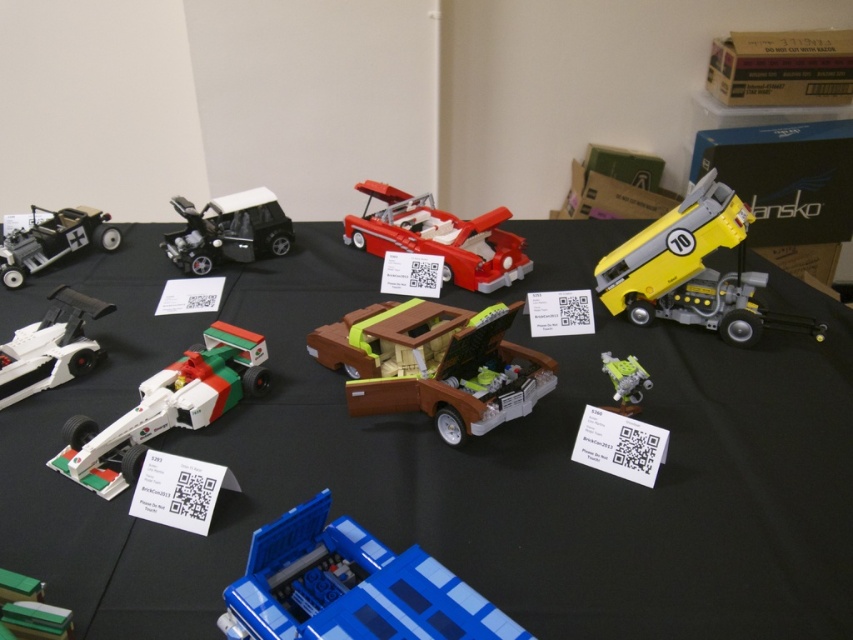
Does point (666, 289) lie in front of point (13, 388)?

That is False.

Between yellow matte truck at right and white matte racing car at left, which one is positioned higher?

yellow matte truck at right is above.

Is point (691, 269) more distant than point (41, 376)?

Yes, it is behind point (41, 376).

Where is `yellow matte truck at right`? Image resolution: width=853 pixels, height=640 pixels. yellow matte truck at right is located at coordinates (692, 269).

Does point (433, 403) come behind point (84, 340)?

No, (433, 403) is in front of (84, 340).

Who is higher up, brown matte car at center or white matte racing car at left?

white matte racing car at left

Is point (393, 408) behind point (91, 353)?

That is False.

The height and width of the screenshot is (640, 853). What are the coordinates of `brown matte car at center` in the screenshot? It's located at (433, 365).

Is matte black car at left behind green plastic robot at lower right?

That is True.

Can you confirm if matte black car at left is wider than green plastic robot at lower right?

Yes.

Is point (74, 237) positioned after point (633, 392)?

Yes, it is behind point (633, 392).

Locate an element on the screen. This screenshot has height=640, width=853. matte black car at left is located at coordinates (53, 241).